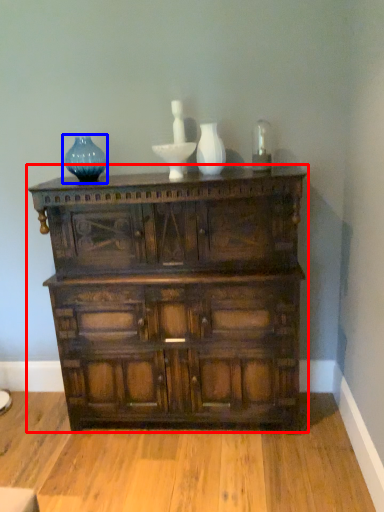
Question: Which of the following is the closest to the observer, chest of drawers (highlighted by a red box) or vase (highlighted by a blue box)?

Choices:
 (A) chest of drawers
 (B) vase

Answer: (A)